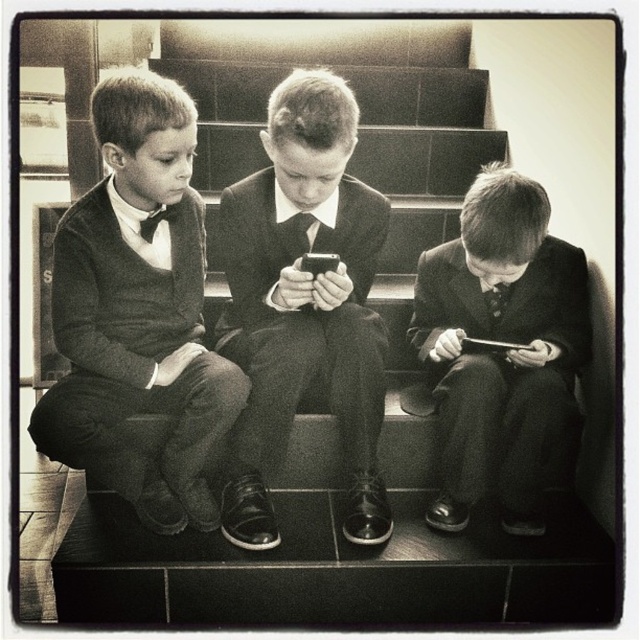
You are an observer standing at the bottom of the staircase in the image. You notice two boys wearing dark clothing. The first boy has a matte black sweater at left, and the second boy is wearing a smooth black suit at center. Which boy is closer to you?

The matte black sweater at left is closer to you because the smooth black suit at center is behind it.

You are standing in front of the staircase where the three boys are sitting. You want to pick up the black matte smartphone at center without disturbing the smooth suit at center. Is the smartphone closer to you or farther away than the suit?

The smooth suit at center is further to the viewer than the black matte smartphone at center, so the smartphone is actually farther away from you than the suit. Therefore, you can reach for the smartphone without disturbing the suit since it is behind the suit.